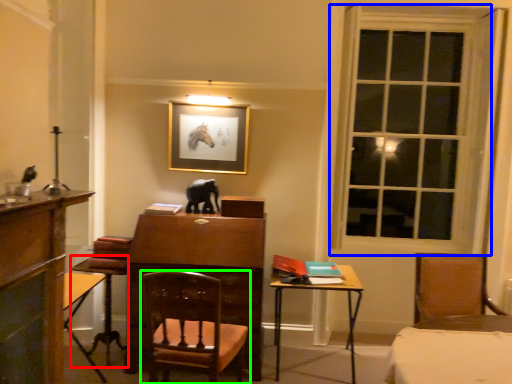
Question: Which object is the closest to the table (highlighted by a red box)? Choose among these: window (highlighted by a blue box) or chair (highlighted by a green box).

Choices:
 (A) window
 (B) chair

Answer: (B)